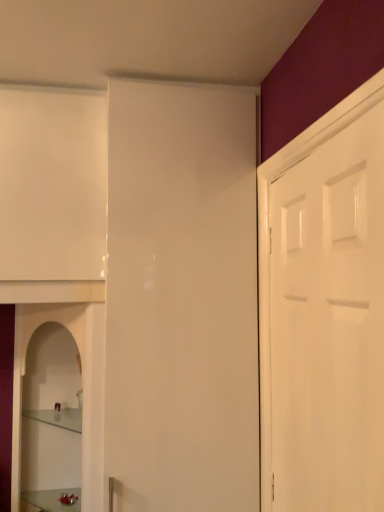
Question: In terms of width, does clear glass cabinet at lower left look wider or thinner when compared to clear glass shelf at lower left?

Choices:
 (A) wide
 (B) thin

Answer: (A)

Question: In the image, is clear glass cabinet at lower left on the left side or the right side of clear glass shelf at lower left?

Choices:
 (A) left
 (B) right

Answer: (A)

Question: Estimate the real-world distances between objects in this image. Which object is farther from the clear glass cabinet at lower left?

Choices:
 (A) metallic silver tray at lower left
 (B) clear glass shelf at lower left
 (C) white glossy door at right

Answer: (C)

Question: Estimate the real-world distances between objects in this image. Which object is farther from the clear glass cabinet at lower left?

Choices:
 (A) white glossy door at right
 (B) clear glass shelf at lower left
 (C) metallic silver tray at lower left

Answer: (A)